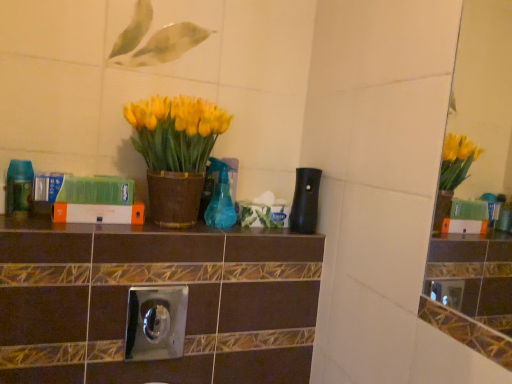
Question: Can you confirm if translucent green bottle at left, which appears as the 3th bottle when viewed from the right, is positioned to the right of matte brown pot at center?

Choices:
 (A) no
 (B) yes

Answer: (A)

Question: Is translucent green bottle at left, which appears as the 3th bottle when viewed from the right, not inside matte brown pot at center?

Choices:
 (A) yes
 (B) no

Answer: (A)

Question: Considering the relative sizes of translucent green bottle at left, the first bottle positioned from the left, and matte brown pot at center in the image provided, is translucent green bottle at left, the first bottle positioned from the left, smaller than matte brown pot at center?

Choices:
 (A) no
 (B) yes

Answer: (B)

Question: Would you say translucent green bottle at left, which appears as the 3th bottle when viewed from the right, contains matte brown pot at center?

Choices:
 (A) yes
 (B) no

Answer: (B)

Question: Is translucent green bottle at left, the first bottle positioned from the left, shorter than matte brown pot at center?

Choices:
 (A) no
 (B) yes

Answer: (B)

Question: Does translucent green bottle at left, the first bottle positioned from the left, have a greater width compared to matte brown pot at center?

Choices:
 (A) yes
 (B) no

Answer: (B)

Question: Is black matte bottle at center, which appears as the 3th bottle when viewed from the left, closer to the viewer compared to translucent green bottle at left, the first bottle positioned from the left?

Choices:
 (A) no
 (B) yes

Answer: (A)

Question: Does black matte bottle at center, the 1th bottle viewed from the right, have a larger size compared to translucent green bottle at left, the first bottle positioned from the left?

Choices:
 (A) no
 (B) yes

Answer: (B)

Question: Does black matte bottle at center, which appears as the 3th bottle when viewed from the left, have a greater height compared to translucent green bottle at left, the first bottle positioned from the left?

Choices:
 (A) yes
 (B) no

Answer: (A)

Question: Is black matte bottle at center, the 1th bottle viewed from the right, looking in the opposite direction of translucent green bottle at left, which appears as the 3th bottle when viewed from the right?

Choices:
 (A) yes
 (B) no

Answer: (B)

Question: Is black matte bottle at center, the 1th bottle viewed from the right, wider than translucent green bottle at left, the first bottle positioned from the left?

Choices:
 (A) no
 (B) yes

Answer: (B)

Question: From the image's perspective, would you say black matte bottle at center, which appears as the 3th bottle when viewed from the left, is positioned over translucent green bottle at left, the first bottle positioned from the left?

Choices:
 (A) no
 (B) yes

Answer: (A)

Question: From a real-world perspective, is matte brown pot at center physically below translucent blue spray bottle at center, which is the second bottle in left-to-right order?

Choices:
 (A) no
 (B) yes

Answer: (A)